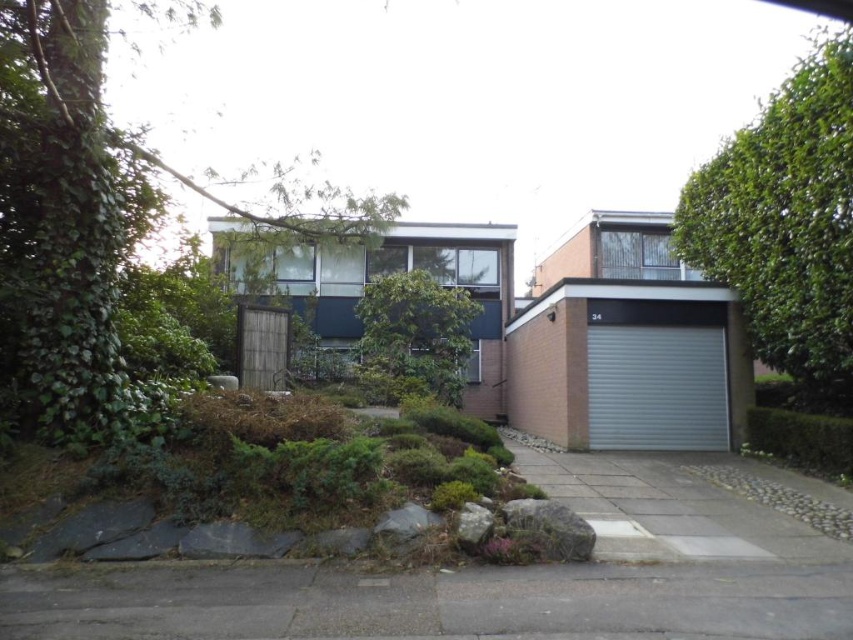
Between metallic silver garage at lower right and brick garage at center, which one is positioned higher?

brick garage at center is higher up.

Is metallic silver garage at lower right shorter than brick garage at center?

Indeed, metallic silver garage at lower right has a lesser height compared to brick garage at center.

Between point (724, 358) and point (224, 257), which one is positioned in front?

Point (724, 358) is in front.

At what (x,y) coordinates should I click in order to perform the action: click on metallic silver garage at lower right. Please return your answer as a coordinate pair (x, y). This screenshot has width=853, height=640. Looking at the image, I should click on (630, 365).

Which is below, brick garage at center or gray metallic garage door at lower right?

gray metallic garage door at lower right is below.

Which of these two, brick garage at center or gray metallic garage door at lower right, stands shorter?

With less height is gray metallic garage door at lower right.

Is point (322, 260) positioned before point (608, 444)?

No, it is behind (608, 444).

The width and height of the screenshot is (853, 640). I want to click on brick garage at center, so click(x=409, y=269).

Is gray concrete driveway at lower center smaller than metallic silver garage at lower right?

Yes.

From the picture: Is gray concrete driveway at lower center to the right of metallic silver garage at lower right from the viewer's perspective?

No, gray concrete driveway at lower center is not to the right of metallic silver garage at lower right.

Between point (683, 634) and point (699, 419), which one is positioned behind?

Point (699, 419)

This screenshot has width=853, height=640. I want to click on gray concrete driveway at lower center, so click(430, 602).